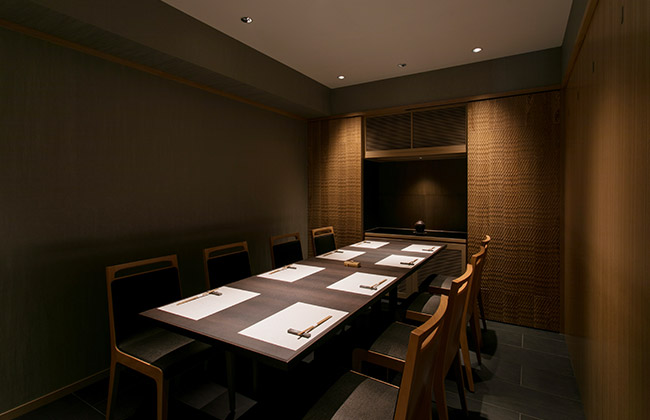
This screenshot has width=650, height=420. I want to click on white ceiling, so click(335, 16), click(517, 134), click(522, 134).